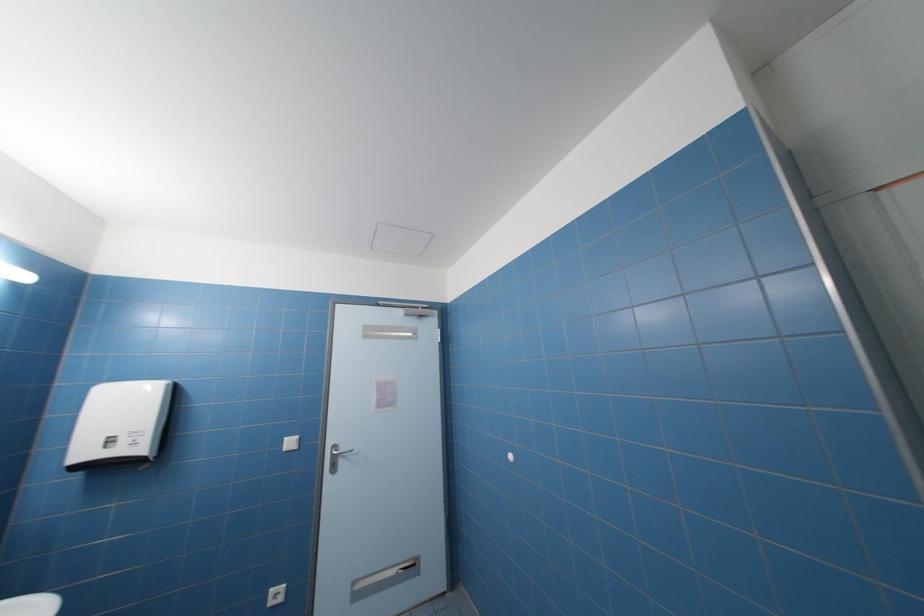
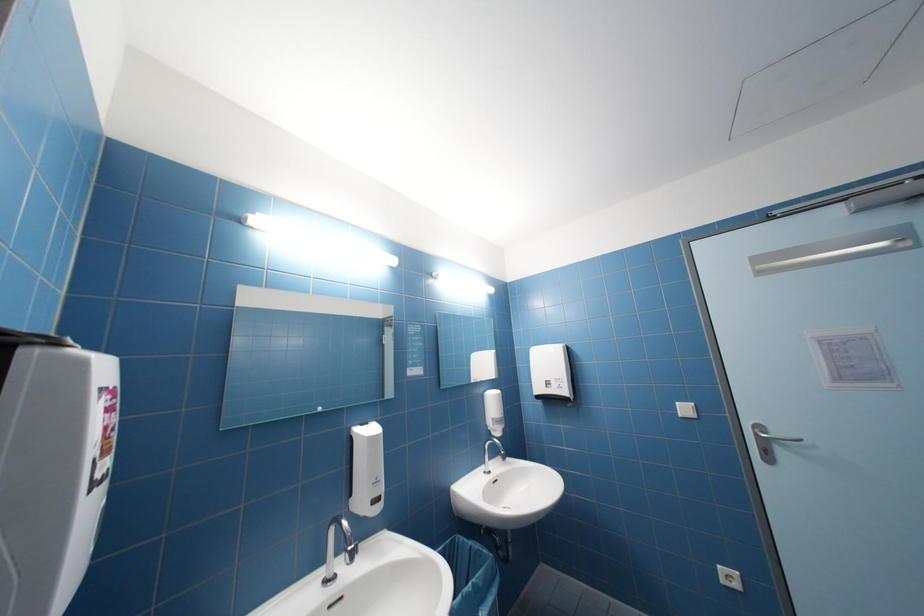
Question: The camera is either moving clockwise (left) or counter-clockwise (right) around the object. The first image is from the beginning of the video and the second image is from the end. Is the camera moving left or right when shooting the video?

Choices:
 (A) Left
 (B) Right

Answer: (B)